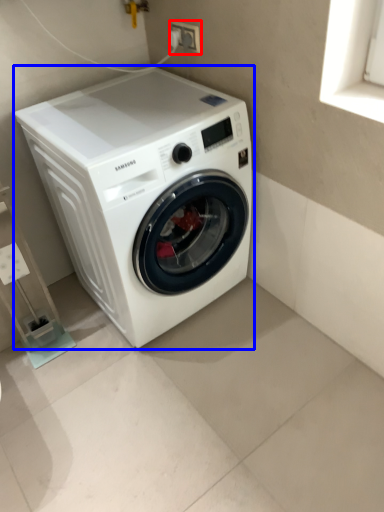
Question: Among these objects, which one is nearest to the camera, electric outlet (highlighted by a red box) or washing machine (highlighted by a blue box)?

Choices:
 (A) electric outlet
 (B) washing machine

Answer: (B)